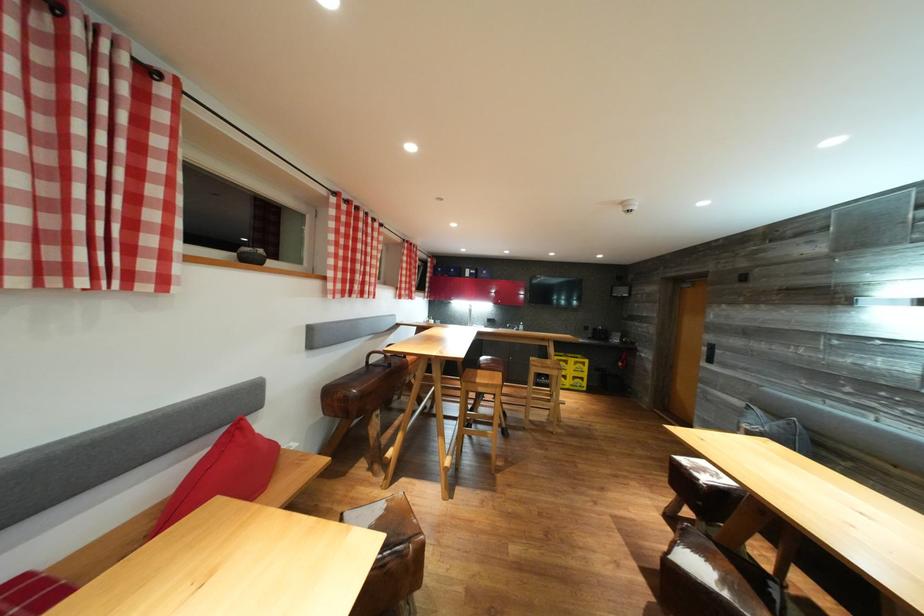
Where is `silver faucet handle`? silver faucet handle is located at coordinates (509, 326).